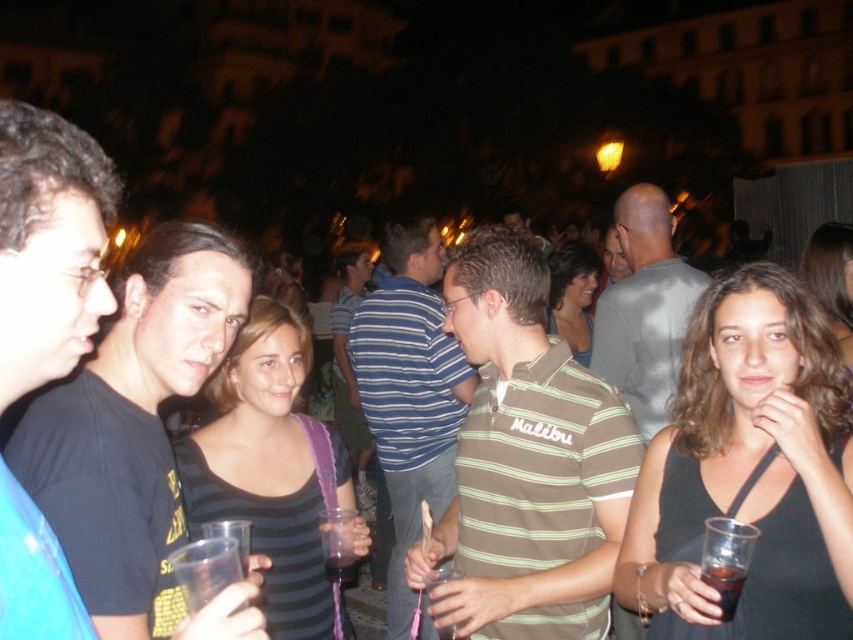
Question: Which point is closer to the camera?

Choices:
 (A) (409, 458)
 (B) (730, 616)
 (C) (352, 564)
 (D) (625, 436)

Answer: (B)

Question: Is striped cotton shirt at center wider than gray cotton shirt at center?

Choices:
 (A) yes
 (B) no

Answer: (A)

Question: Among these objects, which one is nearest to the camera?

Choices:
 (A) translucent plastic cup at center
 (B) black matte shirt at left
 (C) gray cotton shirt at center

Answer: (B)

Question: Does black matte shirt at left have a lesser width compared to dark brown liquid at lower right?

Choices:
 (A) yes
 (B) no

Answer: (B)

Question: Does green striped polo shirt at center have a greater width compared to translucent plastic cup at center?

Choices:
 (A) yes
 (B) no

Answer: (A)

Question: Which point appears farthest from the camera in this image?

Choices:
 (A) (666, 205)
 (B) (395, 392)

Answer: (B)